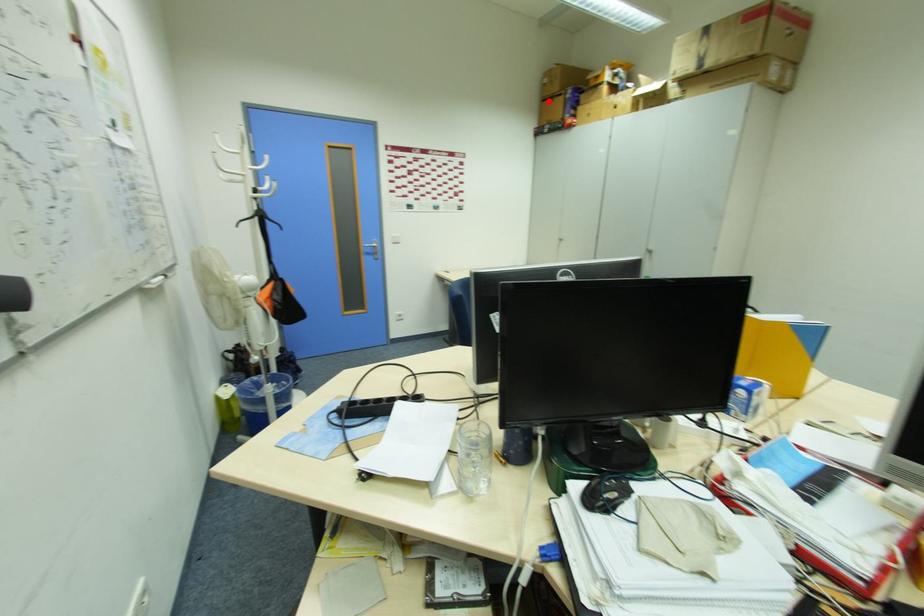
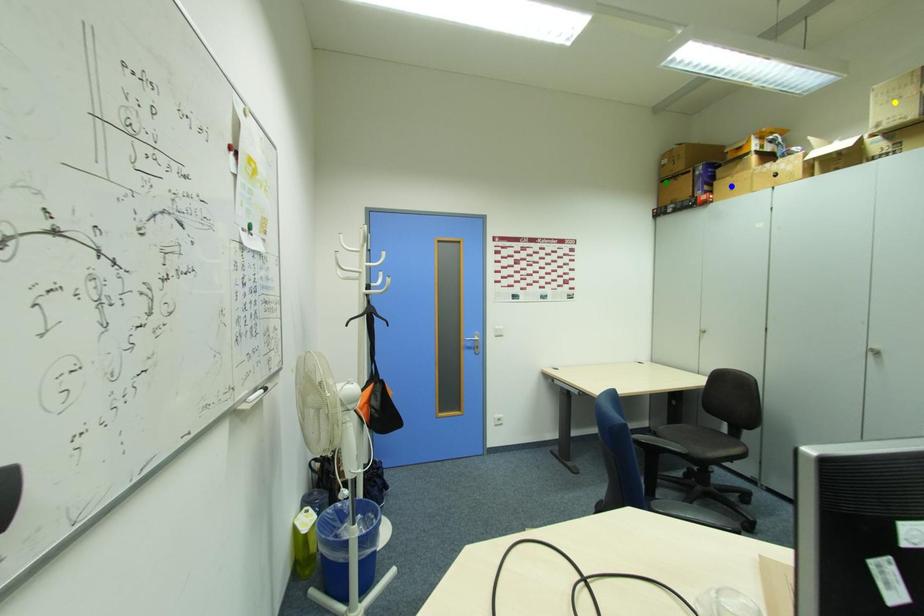
Question: I am providing you with two images of the same scene from different viewpoints. A red point is marked on the first image. You are given multiple points on the second image. Which spot in image 2 lines up with the point in image 1?

Choices:
 (A) blue point
 (B) green point
 (C) yellow point

Answer: (B)